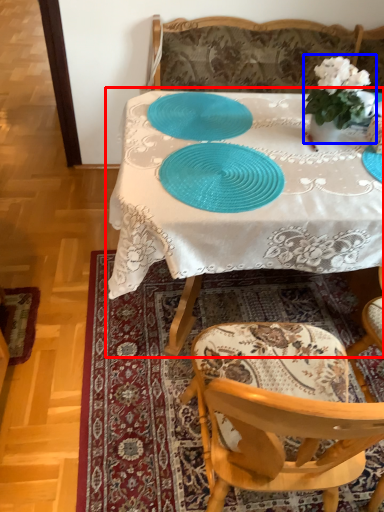
Question: Among these objects, which one is farthest to the camera, table (highlighted by a red box) or houseplant (highlighted by a blue box)?

Choices:
 (A) table
 (B) houseplant

Answer: (B)